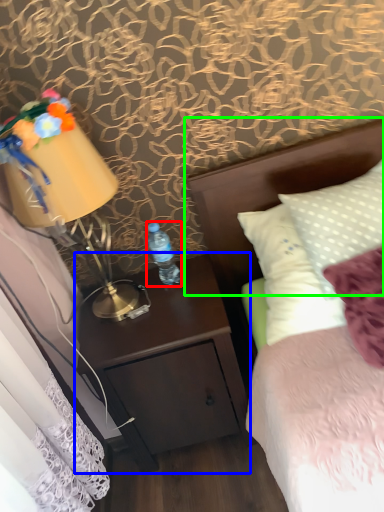
Question: Considering the real-world distances, which object is farthest from bottle (highlighted by a red box)? nightstand (highlighted by a blue box) or headboard (highlighted by a green box)?

Choices:
 (A) nightstand
 (B) headboard

Answer: (B)